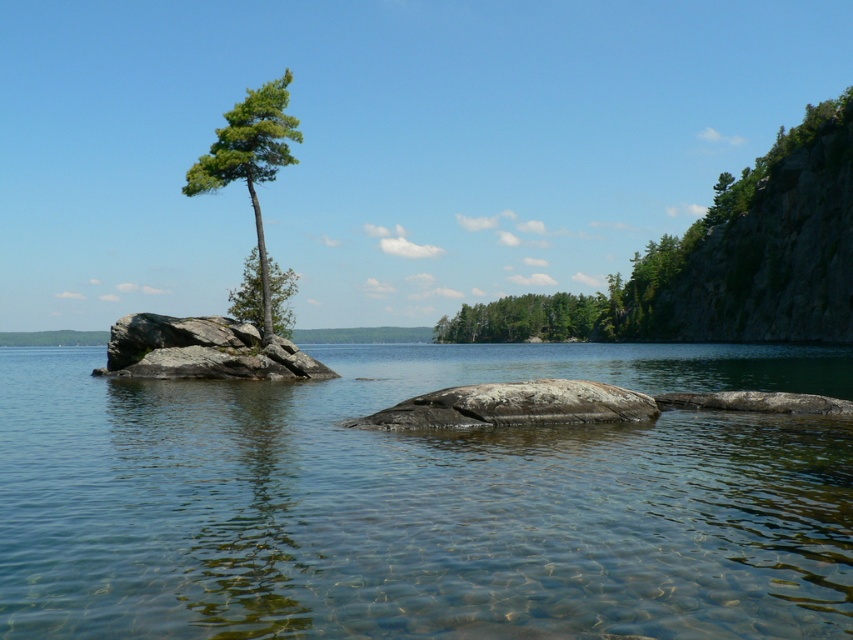
Question: Considering the real-world distances, which object is closest to the green matte tree at center?

Choices:
 (A) gray rock at center
 (B) green leafy tree at right
 (C) green matte tree at center-left
 (D) clear water at center

Answer: (B)

Question: Which point appears farthest from the camera in this image?

Choices:
 (A) (503, 307)
 (B) (229, 115)

Answer: (A)

Question: In this image, where is green leafy tree at right located relative to gray rock at center?

Choices:
 (A) left
 (B) right

Answer: (B)

Question: Does clear water at center appear on the right side of green matte tree at upper left?

Choices:
 (A) yes
 (B) no

Answer: (A)

Question: Does green leafy tree at right appear over green matte tree at center?

Choices:
 (A) yes
 (B) no

Answer: (A)

Question: Which point is farther to the camera?

Choices:
 (A) (184, 330)
 (B) (283, 120)
 (C) (36, 529)

Answer: (B)